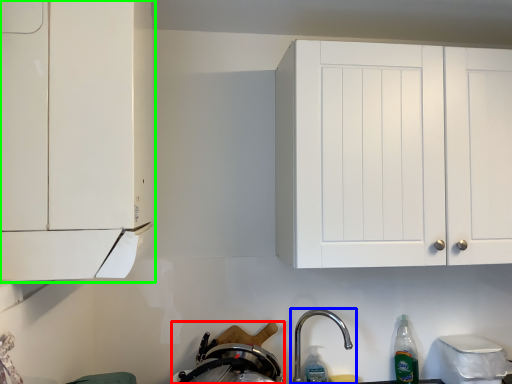
Question: Estimate the real-world distances between objects in this image. Which object is closer to appliance (highlighted by a red box), tap (highlighted by a blue box) or cabinetry (highlighted by a green box)?

Choices:
 (A) tap
 (B) cabinetry

Answer: (A)